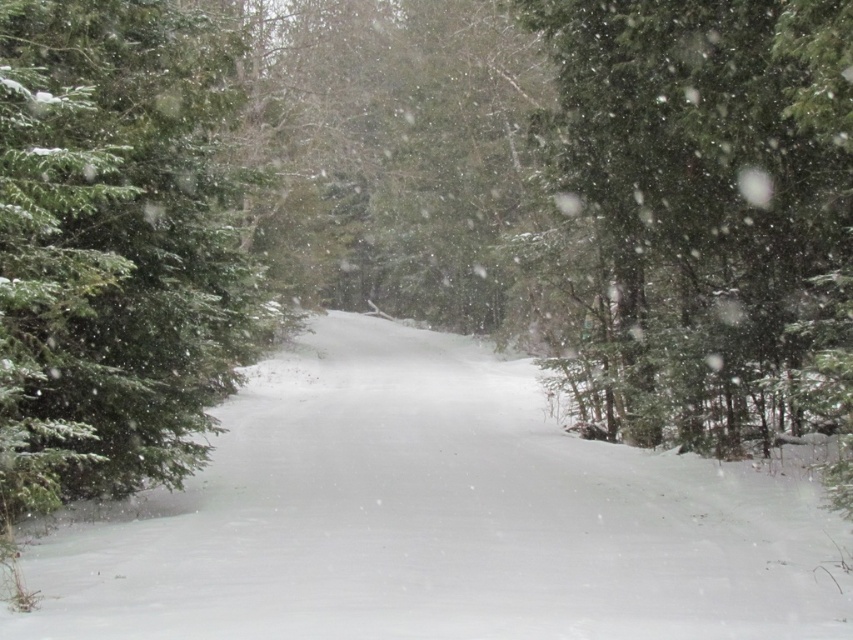
Can you confirm if white fluffy snow at center is positioned to the right of green matte evergreen tree at left?

Yes, white fluffy snow at center is to the right of green matte evergreen tree at left.

What are the coordinates of `white fluffy snow at center` in the screenshot? It's located at (437, 518).

Identify the location of white fluffy snow at center. This screenshot has height=640, width=853. (437, 518).

Which is more to the left, white fluffy snow at center or green matte tree at right?

Positioned to the left is white fluffy snow at center.

Locate an element on the screen. This screenshot has height=640, width=853. white fluffy snow at center is located at coordinates (437, 518).

The image size is (853, 640). Describe the element at coordinates (437, 518) in the screenshot. I see `white fluffy snow at center` at that location.

Locate an element on the screen. white fluffy snow at center is located at coordinates (437, 518).

Is green matte evergreen tree at left in front of green matte tree at right?

Yes.

Between green matte evergreen tree at left and green matte tree at right, which one has less height?

With less height is green matte tree at right.

Locate an element on the screen. The image size is (853, 640). green matte evergreen tree at left is located at coordinates (115, 244).